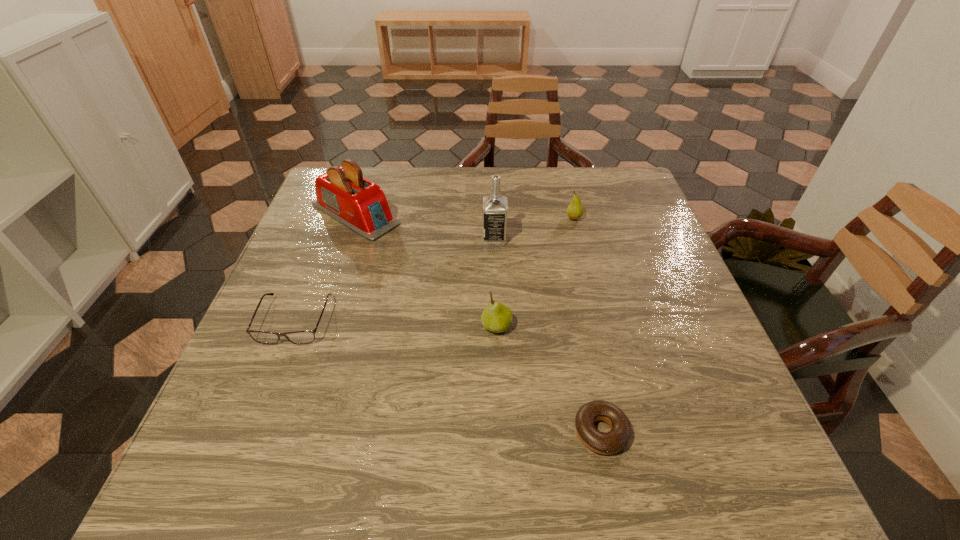
The image size is (960, 540). I want to click on the tallest object, so click(495, 207).

This screenshot has height=540, width=960. What are the coordinates of `toaster` in the screenshot? It's located at (342, 193).

What are the coordinates of `the left pear` in the screenshot? It's located at (496, 317).

Where is `the farther pear`? The image size is (960, 540). the farther pear is located at coordinates (575, 210).

This screenshot has height=540, width=960. I want to click on spectacles, so click(x=297, y=337).

Locate an element on the screen. The width and height of the screenshot is (960, 540). doughnut is located at coordinates (611, 442).

Image resolution: width=960 pixels, height=540 pixels. I want to click on vacant space located on the front label of the vodka, so click(339, 239).

Where is `vacant space located on the front label of the vodka`? Image resolution: width=960 pixels, height=540 pixels. vacant space located on the front label of the vodka is located at coordinates (413, 239).

The width and height of the screenshot is (960, 540). I want to click on vacant space located 0.150m on the front label of the vodka, so click(x=424, y=239).

Identify the location of vacant space located 0.100m on the right of the toaster. (440, 214).